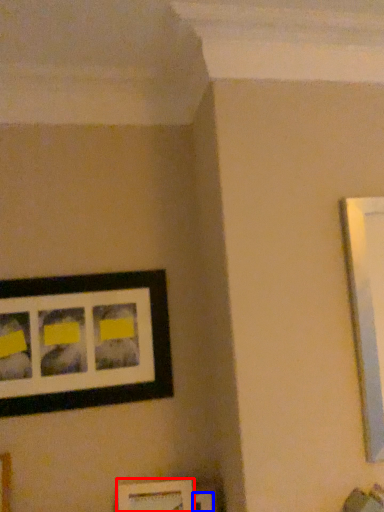
Question: Among these objects, which one is farthest to the camera, picture frame (highlighted by a red box) or picture frame (highlighted by a blue box)?

Choices:
 (A) picture frame
 (B) picture frame

Answer: (B)